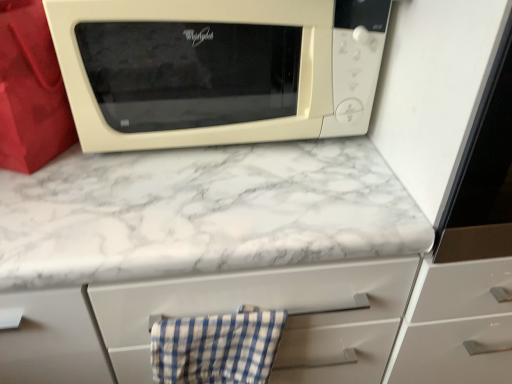
Question: Is blue checkered cloth at lower center thinner than white marble countertop at upper center?

Choices:
 (A) no
 (B) yes

Answer: (B)

Question: Considering the relative positions of blue checkered cloth at lower center and white marble countertop at upper center in the image provided, is blue checkered cloth at lower center in front of white marble countertop at upper center?

Choices:
 (A) yes
 (B) no

Answer: (B)

Question: Is blue checkered cloth at lower center positioned with its back to white marble countertop at upper center?

Choices:
 (A) yes
 (B) no

Answer: (A)

Question: Is blue checkered cloth at lower center wider than white marble countertop at upper center?

Choices:
 (A) yes
 (B) no

Answer: (B)

Question: Is blue checkered cloth at lower center smaller than white marble countertop at upper center?

Choices:
 (A) no
 (B) yes

Answer: (B)

Question: Is blue checkered cloth at lower center facing towards white marble countertop at upper center?

Choices:
 (A) no
 (B) yes

Answer: (A)

Question: From a real-world perspective, is white marble countertop at upper center physically above blue checkered cloth at lower center?

Choices:
 (A) yes
 (B) no

Answer: (B)

Question: Can you confirm if white marble countertop at upper center is shorter than blue checkered cloth at lower center?

Choices:
 (A) no
 (B) yes

Answer: (A)

Question: Is blue checkered cloth at lower center at the back of white marble countertop at upper center?

Choices:
 (A) yes
 (B) no

Answer: (B)

Question: From the image's perspective, does white marble countertop at upper center appear higher than blue checkered cloth at lower center?

Choices:
 (A) yes
 (B) no

Answer: (B)

Question: From the image's perspective, is white marble countertop at upper center beneath blue checkered cloth at lower center?

Choices:
 (A) yes
 (B) no

Answer: (A)

Question: Considering the relative sizes of white marble countertop at upper center and blue checkered cloth at lower center in the image provided, is white marble countertop at upper center bigger than blue checkered cloth at lower center?

Choices:
 (A) yes
 (B) no

Answer: (A)

Question: Is beige matte microwave at upper center facing towards blue checkered cloth at lower center?

Choices:
 (A) yes
 (B) no

Answer: (B)